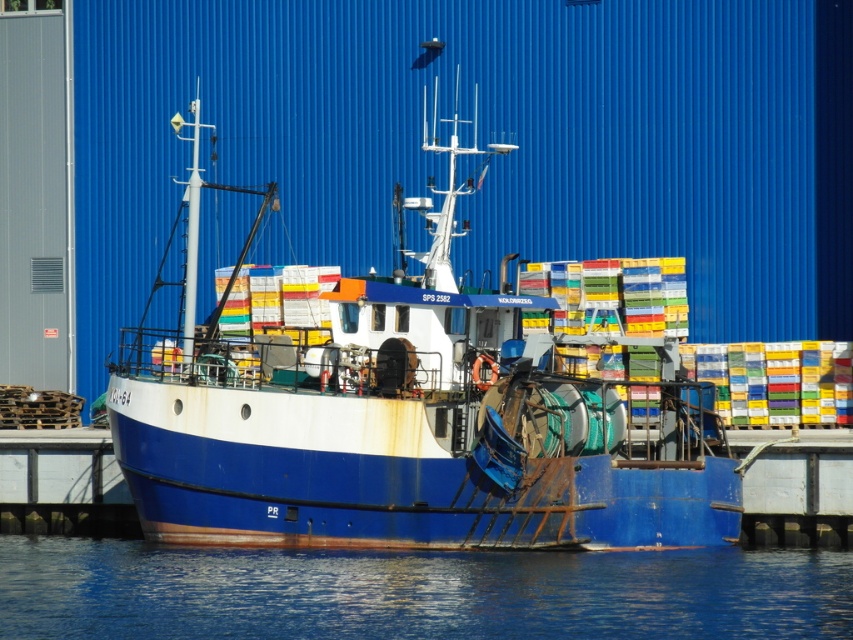
You are standing on the pier next to the fishing boat SPS 2582. You notice a specific point marked at coordinates (335,371). If you want to reach that point with a 30 meter long pole, will your pole be long enough?

The point at (335,371) is 30.50 meters away from the camera. Since the pole is only 30 meters long, it will be 0.50 meters too short to reach the point.

You are standing on the pier and see the blue matte boat at center and the blue water at lower center. Which object is located to the left of the other?

The blue matte boat at center is positioned on the left side of blue water at lower center.